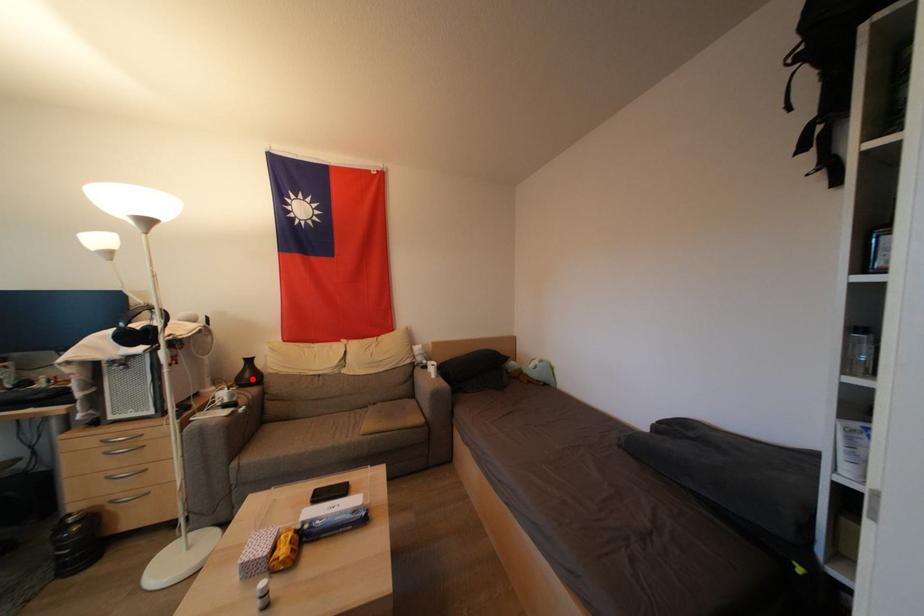
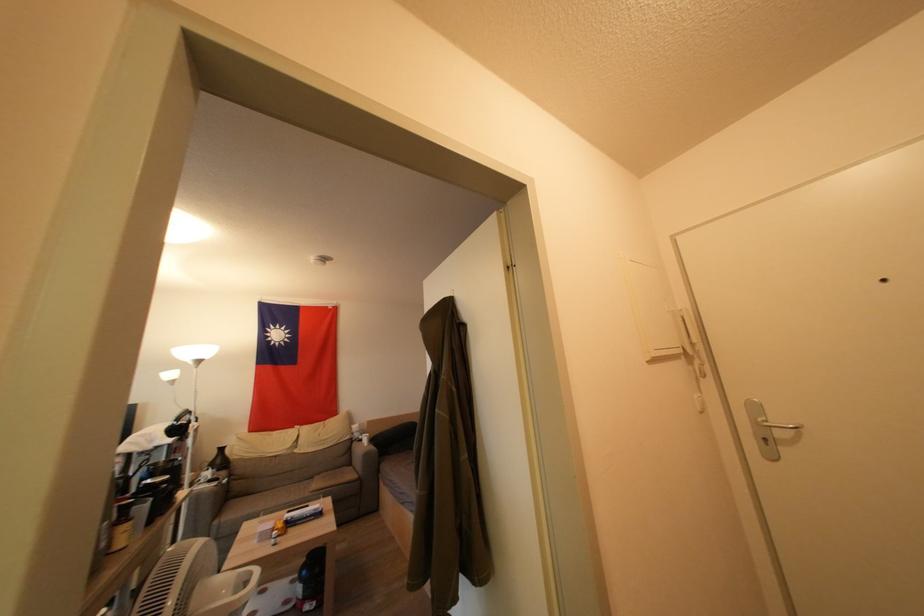
Question: I am providing you with two images of the same scene from different viewpoints. A red point is marked on the first image. At the location where the point appears in image 1, is it still visible in image 2?

Choices:
 (A) Yes
 (B) No

Answer: (A)